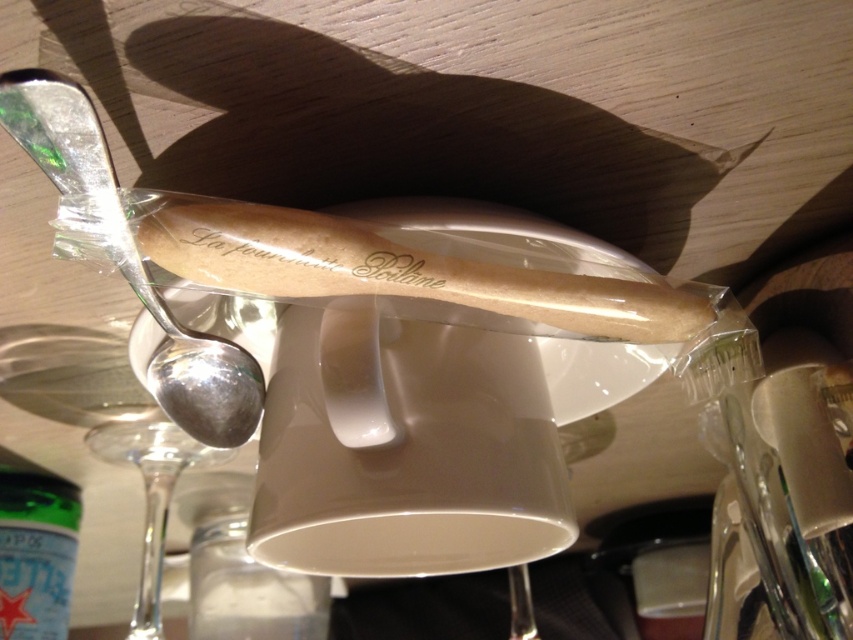
Can you confirm if silver polished spoon at upper left is smaller than transparent glass wine glass at lower left?

Correct, silver polished spoon at upper left occupies less space than transparent glass wine glass at lower left.

Is silver polished spoon at upper left to the right of transparent glass wine glass at lower left from the viewer's perspective?

Indeed, silver polished spoon at upper left is positioned on the right side of transparent glass wine glass at lower left.

The width and height of the screenshot is (853, 640). Describe the element at coordinates (132, 259) in the screenshot. I see `silver polished spoon at upper left` at that location.

Find the location of `silver polished spoon at upper left`. silver polished spoon at upper left is located at coordinates (132, 259).

Between green matte bottle at lower left and transparent glass wine glass at lower left, which one has less height?

green matte bottle at lower left

Between point (55, 564) and point (129, 452), which one is positioned in front?

Point (129, 452) is more forward.

Image resolution: width=853 pixels, height=640 pixels. Find the location of `green matte bottle at lower left`. green matte bottle at lower left is located at coordinates (36, 554).

Find the location of a particular element. The height and width of the screenshot is (640, 853). green matte bottle at lower left is located at coordinates (36, 554).

Describe the element at coordinates (132, 259) in the screenshot. The image size is (853, 640). I see `silver polished spoon at upper left` at that location.

Is point (114, 224) more distant than point (61, 612)?

No, (114, 224) is in front of (61, 612).

Is point (35, 140) positioned in front of point (4, 609)?

That is True.

Find the location of a particular element. This screenshot has width=853, height=640. silver polished spoon at upper left is located at coordinates (132, 259).